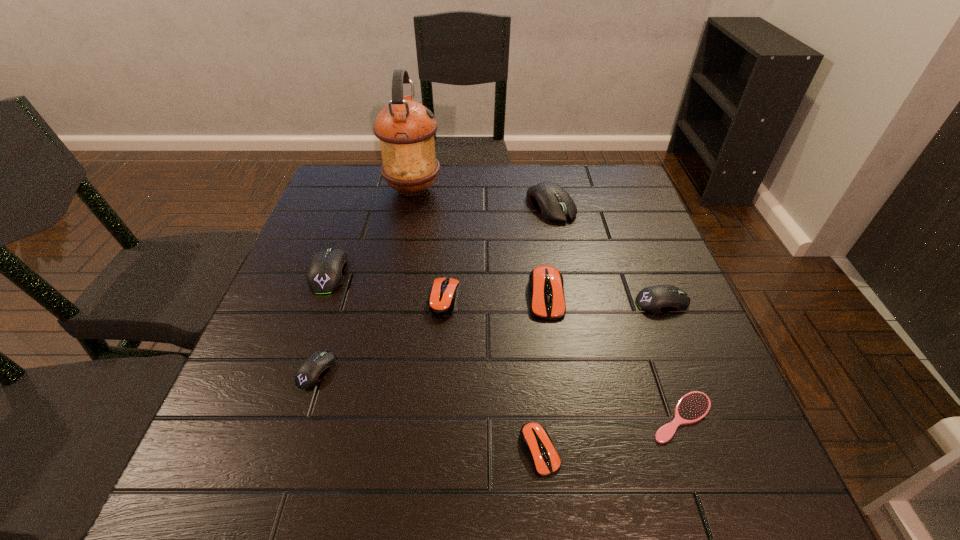
You are a GUI agent. You are given a task and a screenshot of the screen. Output one action in this format:
    pyautogui.click(x=<x>, y=<y>)
    Task: Click on the vacant space situated 0.130m on the right of the third nearest object
    The height and width of the screenshot is (540, 960).
    Given the screenshot: What is the action you would take?
    pyautogui.click(x=400, y=370)

The height and width of the screenshot is (540, 960). What are the coordinates of `vacant space located on the left of the nearest orange computer mouse` in the screenshot? It's located at (472, 450).

I want to click on vacant space located 0.380m on the left of the hairbrush, so click(433, 417).

Where is `oil lamp located at the far edge`? The image size is (960, 540). oil lamp located at the far edge is located at coordinates (405, 128).

Find the location of a particular element. The image size is (960, 540). computer equipment that is positioned at the far edge is located at coordinates (549, 198).

Locate an element on the screen. The image size is (960, 540). object situated at the near edge is located at coordinates (536, 441).

Image resolution: width=960 pixels, height=540 pixels. Find the location of `computer equipment positioned at the right edge`. computer equipment positioned at the right edge is located at coordinates (656, 299).

Where is `hairbrush positioned at the right edge`? hairbrush positioned at the right edge is located at coordinates (692, 407).

In the image, there is a desktop. Identify the location of blank space at the far edge. (459, 167).

What are the coordinates of `vacant space at the near edge` in the screenshot? It's located at (494, 459).